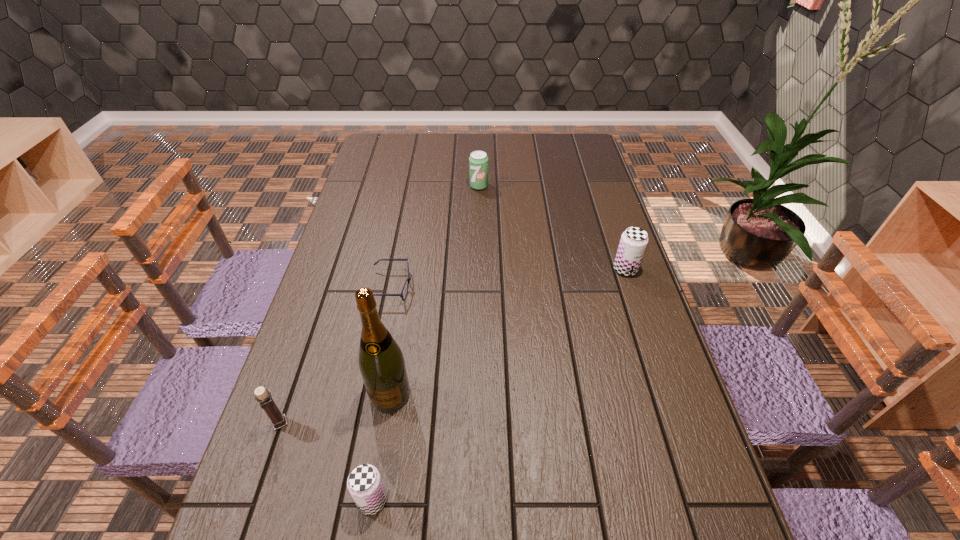
Find the location of a particular element. The height and width of the screenshot is (540, 960). empty space that is in between the tallest object and the farther beer can is located at coordinates (508, 332).

You are a GUI agent. You are given a task and a screenshot of the screen. Output one action in this format:
    pyautogui.click(x=<x>, y=<y>)
    Task: Click on the blank region between the second object from right to left and the right beer can
    This screenshot has width=960, height=540.
    Given the screenshot: What is the action you would take?
    pyautogui.click(x=552, y=228)

The image size is (960, 540). Find the location of `free spot between the tallest object and the second shortest object`. free spot between the tallest object and the second shortest object is located at coordinates (381, 447).

Find the location of a particular element. This screenshot has width=960, height=540. free space between the soda and the tallest object is located at coordinates (435, 290).

Find the location of `vacant point located between the shorter beer can and the soda`. vacant point located between the shorter beer can and the soda is located at coordinates (425, 343).

At what (x,y) coordinates should I click in order to perform the action: click on vacant area between the third nearest object and the taller beer can. Please return your answer as a coordinate pair (x, y). The width and height of the screenshot is (960, 540). Looking at the image, I should click on (508, 332).

Identify which object is the second nearest to the nearer beer can. Please provide its 2D coordinates. Your answer should be formatted as a tuple, i.e. [(x, y)], where the tuple contains the x and y coordinates of a point satisfying the conditions above.

[(263, 396)]

This screenshot has width=960, height=540. What are the coordinates of `object that is the closest to the fifth object from left to right` in the screenshot? It's located at (408, 279).

At what (x,y) coordinates should I click in order to perform the action: click on blank space that satisfies the following two spatial constraints: 1. on the back side of the second object from right to left; 2. on the right side of the leftmost object. Please return your answer as a coordinate pair (x, y). The width and height of the screenshot is (960, 540). Looking at the image, I should click on (361, 186).

Locate an element on the screen. free space that satisfies the following two spatial constraints: 1. on the back side of the nearest object; 2. on the front-facing side of the shortest object is located at coordinates click(407, 287).